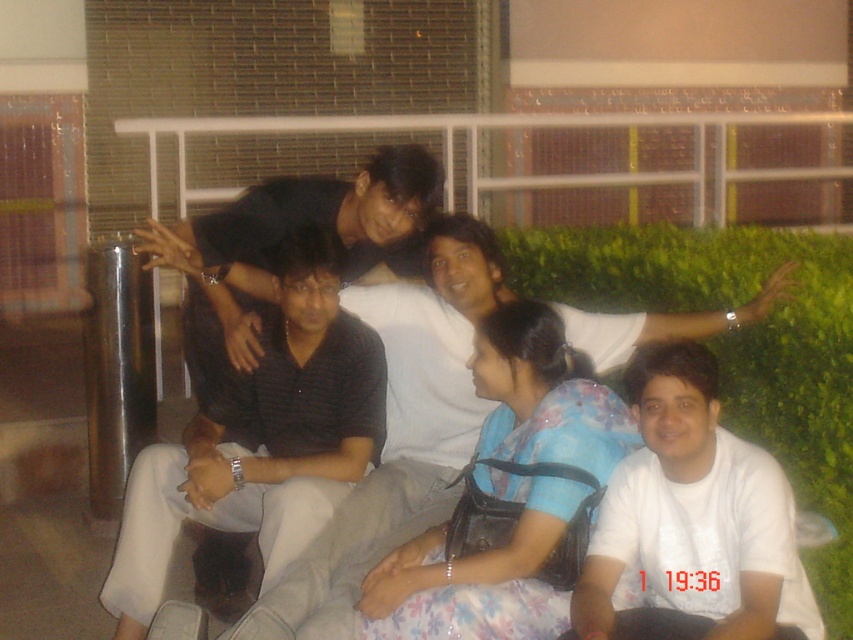
Question: Estimate the real-world distances between objects in this image. Which object is closer to the floral fabric dress at center?

Choices:
 (A) dark gray striped shirt at center
 (B) white matte shirt at lower right
 (C) dark gray shirt at center

Answer: (B)

Question: Is dark gray striped shirt at center to the right of white matte shirt at lower right from the viewer's perspective?

Choices:
 (A) no
 (B) yes

Answer: (A)

Question: Considering the relative positions of dark gray striped shirt at center and white matte shirt at lower right in the image provided, where is dark gray striped shirt at center located with respect to white matte shirt at lower right?

Choices:
 (A) right
 (B) left

Answer: (B)

Question: Is the position of white matte shirt at lower right less distant than that of dark gray shirt at center?

Choices:
 (A) yes
 (B) no

Answer: (A)

Question: Which point is closer to the camera taking this photo?

Choices:
 (A) (459, 435)
 (B) (550, 314)

Answer: (B)

Question: Which point is farther to the camera?

Choices:
 (A) (598, 582)
 (B) (396, 605)
 (C) (370, 490)
 (D) (310, 272)

Answer: (D)